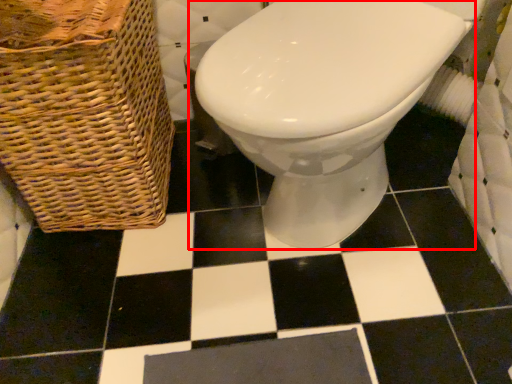
Question: From the image's perspective, what is the correct spatial relationship of toilet (annotated by the red box) in relation to basket?

Choices:
 (A) above
 (B) below

Answer: (B)